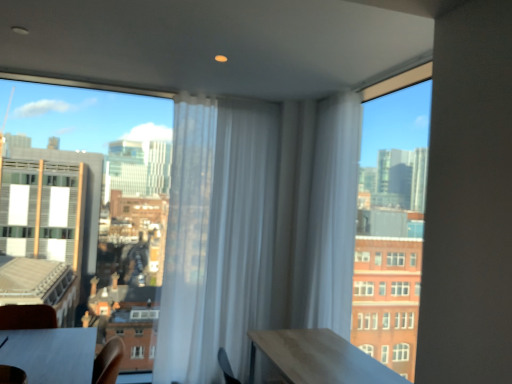
I want to click on free space above white sheer curtain at center, the first curtain positioned from the left (from a real-world perspective), so click(232, 93).